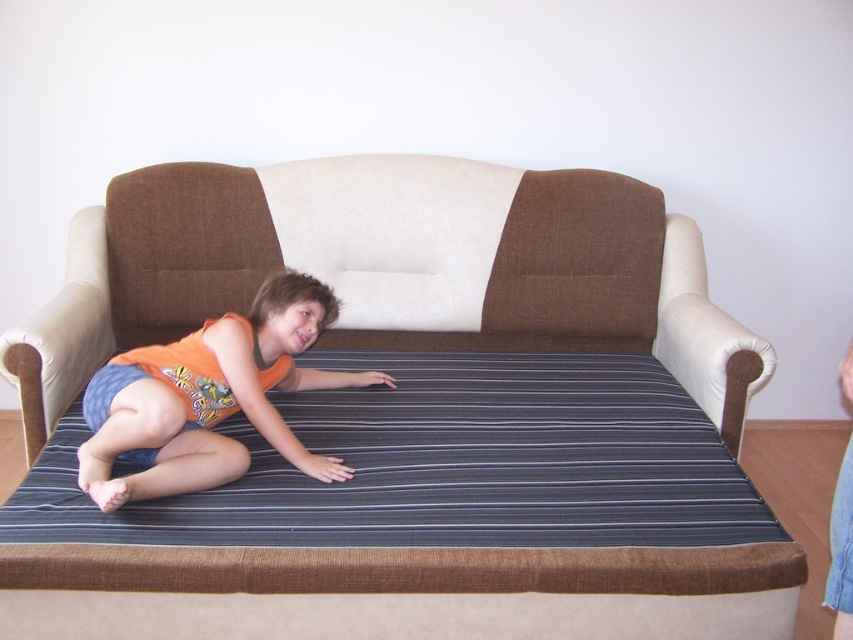
Question: Which point is closer to the camera?

Choices:
 (A) tap(16, 500)
 (B) tap(267, 285)

Answer: (A)

Question: Is brown fabric couch at center bigger than orange cotton tank top at center?

Choices:
 (A) yes
 (B) no

Answer: (A)

Question: From the image, what is the correct spatial relationship of brown fabric couch at center in relation to orange cotton tank top at center?

Choices:
 (A) above
 (B) below

Answer: (A)

Question: Does brown fabric couch at center have a larger size compared to orange cotton tank top at center?

Choices:
 (A) no
 (B) yes

Answer: (B)